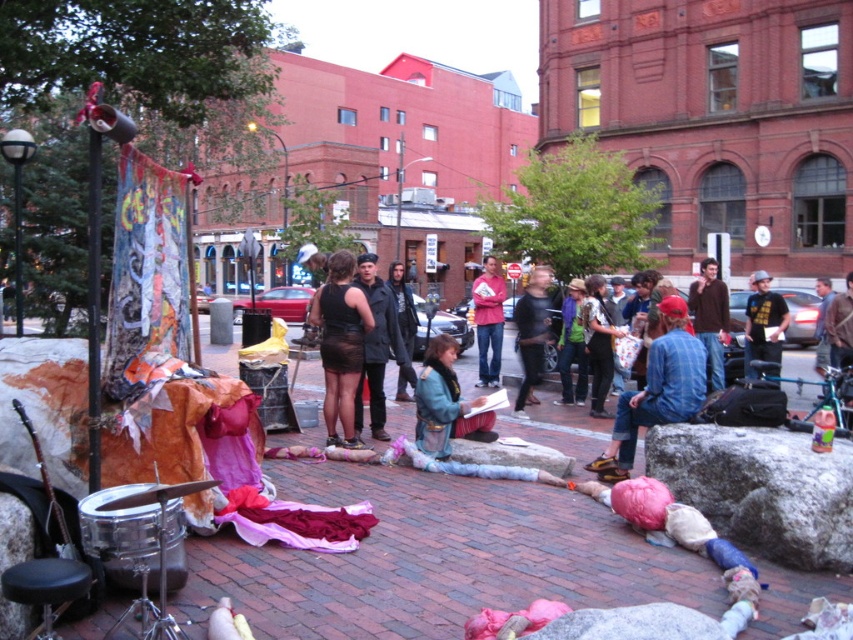
Is blue denim jacket at center positioned in front of black t-shirt at center?

Yes, it is in front of black t-shirt at center.

Does point (422, 406) come in front of point (751, 330)?

Yes, it is.

At what (x,y) coordinates should I click in order to perform the action: click on blue denim jacket at center. Please return your answer as a coordinate pair (x, y). The image size is (853, 640). Looking at the image, I should click on (444, 401).

Is blue denim jacket at center to the left of denim jacket at center from the viewer's perspective?

No, blue denim jacket at center is not to the left of denim jacket at center.

Who is lower down, blue denim jacket at center or denim jacket at center?

Positioned lower is blue denim jacket at center.

Between point (437, 428) and point (360, 269), which one is positioned in front?

Point (437, 428)

Find the location of a particular element. The image size is (853, 640). blue denim jacket at center is located at coordinates (444, 401).

Does pink fabric at center have a greater height compared to black t-shirt at center?

No.

Which is behind, point (489, 339) or point (779, 305)?

Positioned behind is point (489, 339).

From the picture: Who is more forward, (482, 358) or (759, 342)?

Point (759, 342) is in front.

At what (x,y) coordinates should I click in order to perform the action: click on pink fabric at center. Please return your answer as a coordinate pair (x, y). Image resolution: width=853 pixels, height=640 pixels. Looking at the image, I should click on (488, 321).